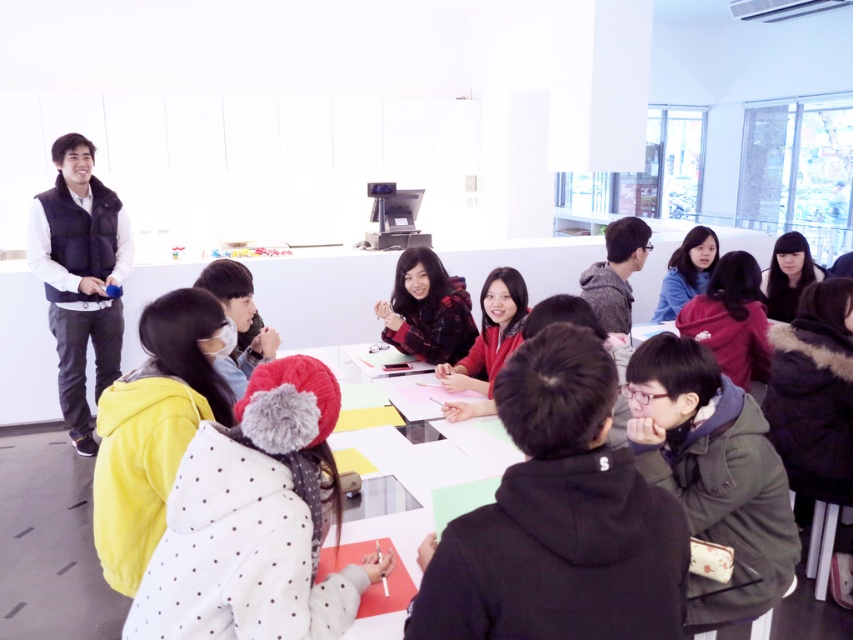
Between point (508, 385) and point (755, 269), which one is positioned in front?

Point (508, 385)

Who is shorter, matte black hoodie at center or matte red jacket at center?

Standing shorter between the two is matte black hoodie at center.

Locate an element on the screen. This screenshot has height=640, width=853. matte black hoodie at center is located at coordinates (560, 518).

Is point (625, 324) positioned after point (688, 257)?

No, (625, 324) is in front of (688, 257).

Who is more forward, (610,321) or (715,250)?

Positioned in front is point (610,321).

Between point (596, 276) and point (697, 273), which one is positioned in front?

Positioned in front is point (596, 276).

You are a GUI agent. You are given a task and a screenshot of the screen. Output one action in this format:
    pyautogui.click(x=<x>, y=<y>)
    Task: Click on the gray hoodie at center
    This screenshot has width=853, height=640.
    Given the screenshot: What is the action you would take?
    pyautogui.click(x=616, y=273)

Who is positioned more to the left, dark green jacket at lower right or gray hoodie at center?

dark green jacket at lower right is more to the left.

Does point (737, 493) lie in front of point (625, 272)?

Yes, point (737, 493) is in front of point (625, 272).

You are a GUI agent. You are given a task and a screenshot of the screen. Output one action in this format:
    pyautogui.click(x=<x>, y=<y>)
    Task: Click on the dark green jacket at lower right
    
    Given the screenshot: What is the action you would take?
    pyautogui.click(x=712, y=474)